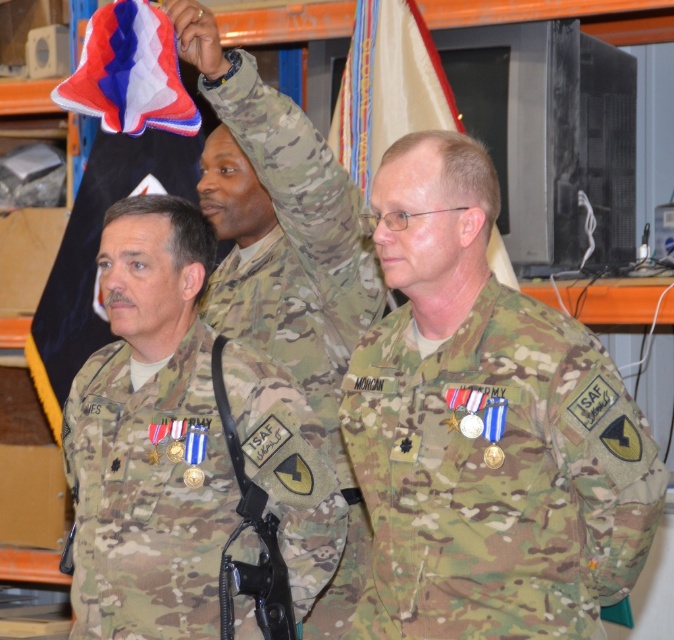
Question: Does red and white fabric flag at upper left have a greater width compared to yellow fabric flag at upper center?

Choices:
 (A) no
 (B) yes

Answer: (B)

Question: Is multicam uniform at center wider than red and white fabric flag at upper left?

Choices:
 (A) no
 (B) yes

Answer: (A)

Question: Which point is closer to the camera?

Choices:
 (A) (152, 496)
 (B) (365, 150)

Answer: (A)

Question: Which of the following is the farthest from the observer?

Choices:
 (A) red and white fabric flag at upper left
 (B) camo fabric uniform at center
 (C) yellow fabric flag at upper center

Answer: (A)

Question: Is camouflage uniform at center below multicam uniform at center?

Choices:
 (A) yes
 (B) no

Answer: (B)

Question: Which point is farther to the camera?

Choices:
 (A) velvet-like fabric flag at upper left
 (B) camouflage uniform at center
 (C) camo fabric uniform at center

Answer: (A)